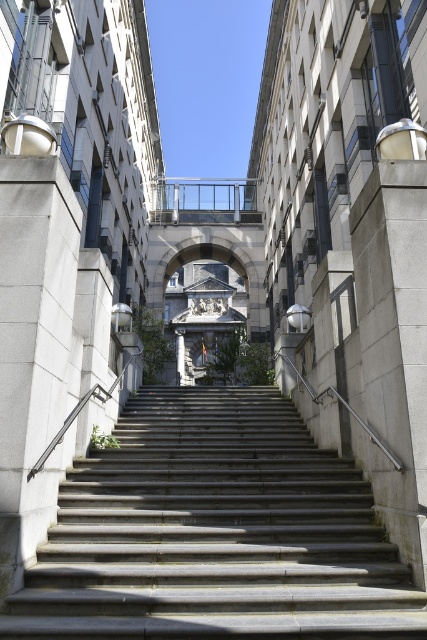
Question: Which object is closer to the camera taking this photo?

Choices:
 (A) clear glass balustrade at upper center
 (B) gray concrete stairs at center

Answer: (B)

Question: Can you confirm if gray concrete stairs at center is smaller than clear glass balustrade at upper center?

Choices:
 (A) no
 (B) yes

Answer: (A)

Question: Can you confirm if gray concrete stairs at center is wider than clear glass balustrade at upper center?

Choices:
 (A) yes
 (B) no

Answer: (A)

Question: Which of the following is the farthest from the observer?

Choices:
 (A) (254, 220)
 (B) (300, 452)

Answer: (A)

Question: From the image, what is the correct spatial relationship of gray concrete stairs at center in relation to clear glass balustrade at upper center?

Choices:
 (A) above
 (B) below

Answer: (B)